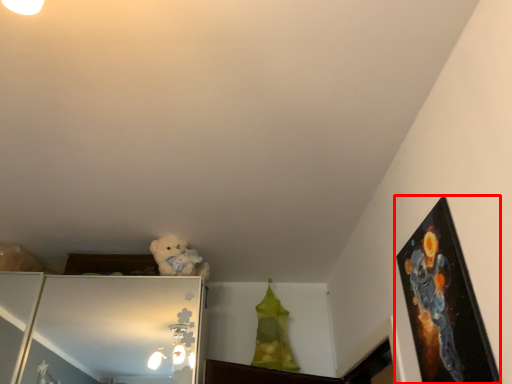
Question: From the image's perspective, what is the correct spatial relationship of picture frame (annotated by the red box) in relation to animal?

Choices:
 (A) below
 (B) above

Answer: (B)